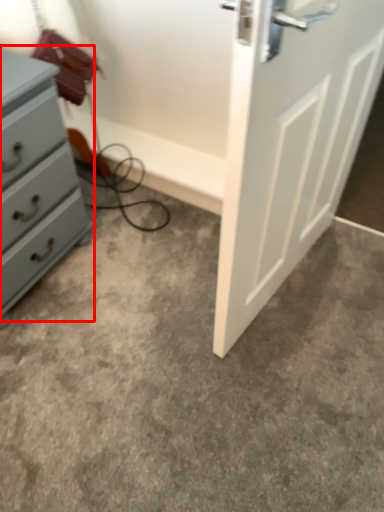
Question: Where is chest of drawers (annotated by the red box) located in relation to concrete in the image?

Choices:
 (A) right
 (B) left

Answer: (B)